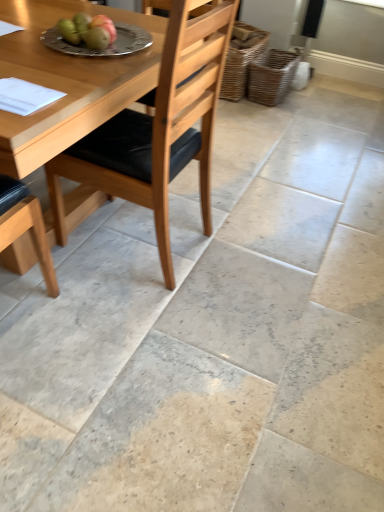
Locate an element on the screen. vacant area situated to the left side of green matte pear at upper left, which appears as the 2th fruit when viewed from the left is located at coordinates (31, 45).